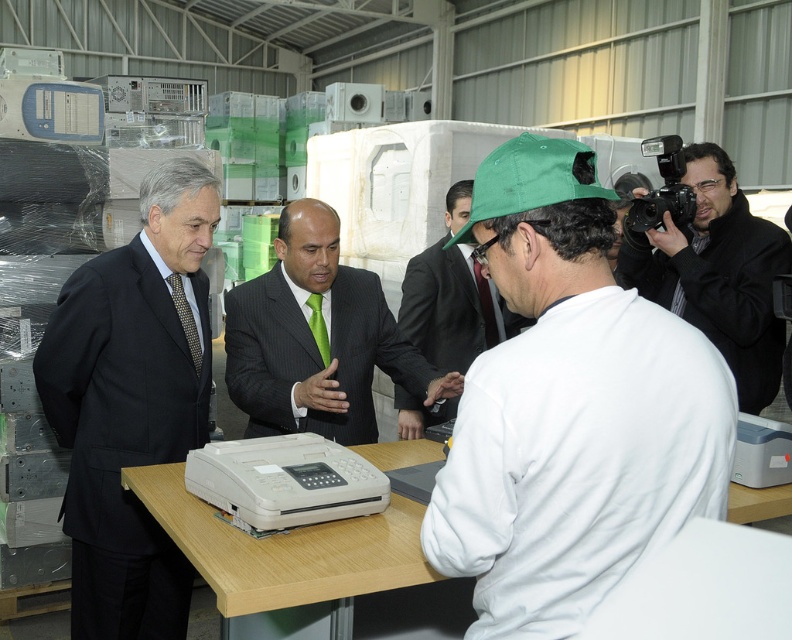
Which is more to the left, white matte shirt at center or white plastic printer at center?

Positioned to the left is white plastic printer at center.

Is white matte shirt at center above white plastic printer at center?

Indeed, white matte shirt at center is positioned over white plastic printer at center.

Consider the image. Who is more forward, (619,493) or (212,499)?

Point (619,493) is in front.

This screenshot has height=640, width=792. In order to click on white matte shirt at center in this screenshot , I will do pyautogui.click(x=569, y=408).

Is black suit at left taller than white plastic printer at center?

Correct, black suit at left is much taller as white plastic printer at center.

Is the position of black suit at left less distant than that of white plastic printer at center?

No, black suit at left is behind white plastic printer at center.

Is point (61, 397) positioned after point (322, 451)?

That is True.

Locate an element on the screen. black suit at left is located at coordinates (132, 403).

Does black suit at left have a lesser width compared to black glossy camera at upper right?

Correct, black suit at left's width is less than black glossy camera at upper right's.

Is point (181, 380) positioned before point (725, 193)?

Yes, point (181, 380) is in front of point (725, 193).

Locate an element on the screen. The width and height of the screenshot is (792, 640). black suit at left is located at coordinates (132, 403).